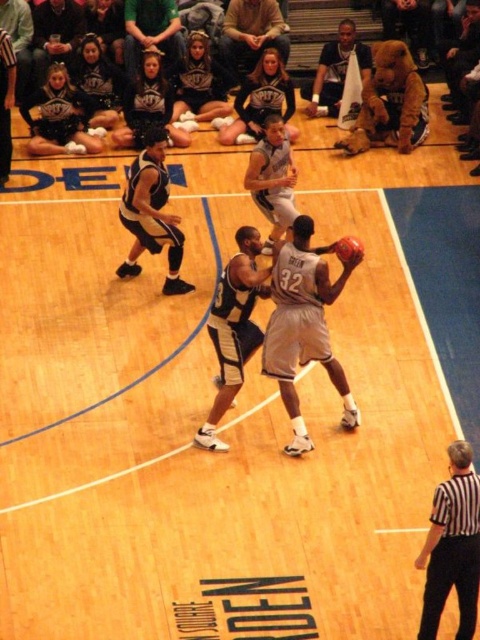
Does black striped shirt at lower right appear on the left side of matte gray jersey at center?

In fact, black striped shirt at lower right is to the right of matte gray jersey at center.

The height and width of the screenshot is (640, 480). Describe the element at coordinates (453, 547) in the screenshot. I see `black striped shirt at lower right` at that location.

Is point (456, 440) more distant than point (262, 33)?

No, it is in front of (262, 33).

Identify the location of black striped shirt at lower right. coord(453,547).

Between white matte basketball player at center and dark blue jersey at center, which one appears on the right side from the viewer's perspective?

Positioned to the right is white matte basketball player at center.

Can you confirm if white matte basketball player at center is positioned below dark blue jersey at center?

No.

Which is behind, point (312, 321) or point (242, 291)?

The point (312, 321) is behind.

Locate an element on the screen. white matte basketball player at center is located at coordinates coord(302,326).

Does black striped shirt at lower right appear on the right side of dark blue jersey at left?

Correct, you'll find black striped shirt at lower right to the right of dark blue jersey at left.

Does black striped shirt at lower right appear over dark blue jersey at left?

Incorrect, black striped shirt at lower right is not positioned above dark blue jersey at left.

You are a GUI agent. You are given a task and a screenshot of the screen. Output one action in this format:
    pyautogui.click(x=<x>, y=<y>)
    Task: Click on the black striped shirt at lower right
    The width and height of the screenshot is (480, 640).
    Given the screenshot: What is the action you would take?
    pyautogui.click(x=453, y=547)